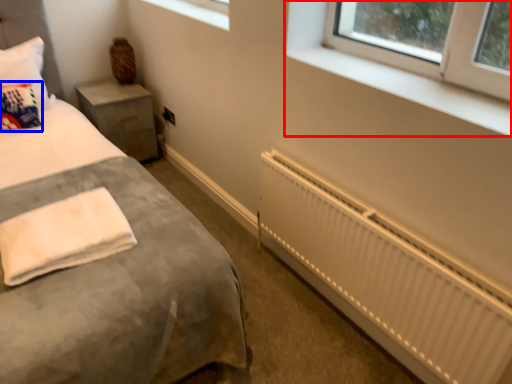
Question: Which object is further to the camera taking this photo, window (highlighted by a red box) or throw pillow (highlighted by a blue box)?

Choices:
 (A) window
 (B) throw pillow

Answer: (B)